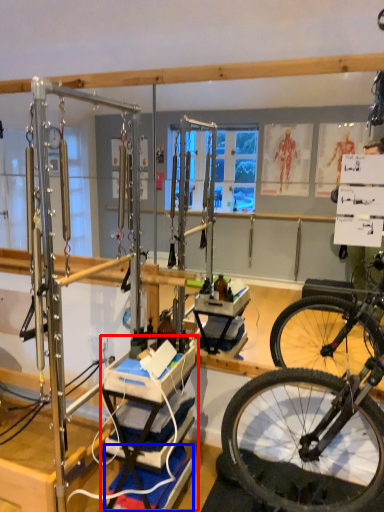
Question: Among these objects, which one is nearest to the camera, workbench (highlighted by a red box) or yoga mat (highlighted by a blue box)?

Choices:
 (A) workbench
 (B) yoga mat

Answer: (A)